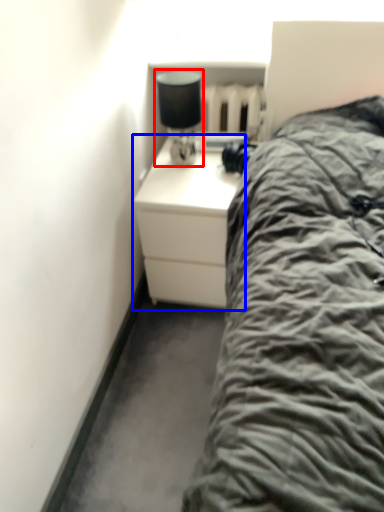
Question: Which object appears closest to the camera in this image, bedside lamp (highlighted by a red box) or chest of drawers (highlighted by a blue box)?

Choices:
 (A) bedside lamp
 (B) chest of drawers

Answer: (A)